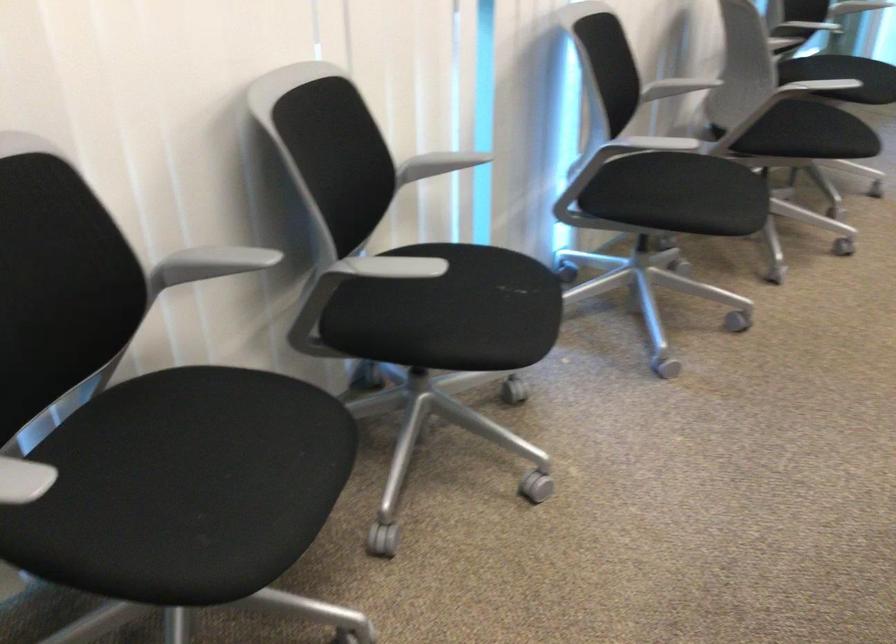
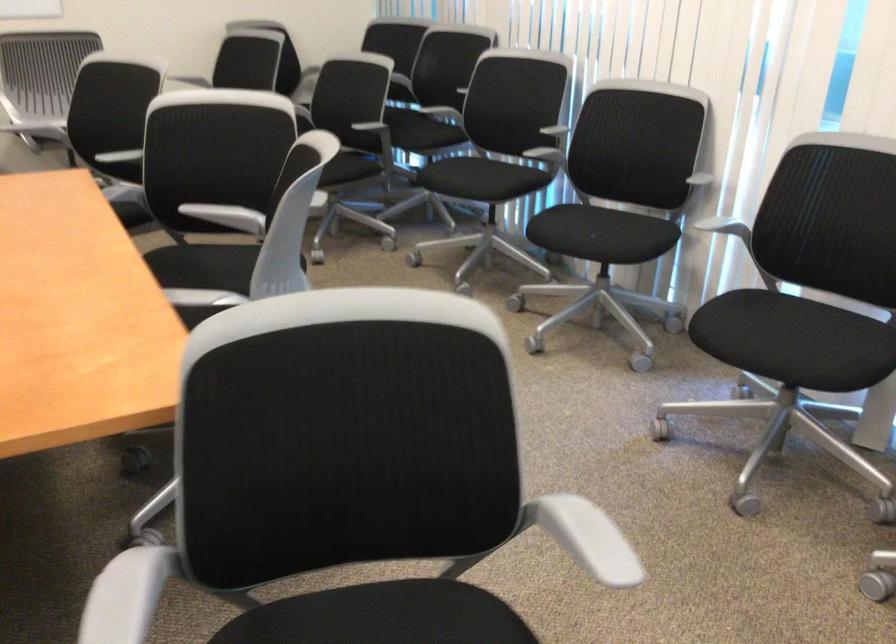
The point at (705,171) is marked in the first image. Where is the corresponding point in the second image?

(795, 342)